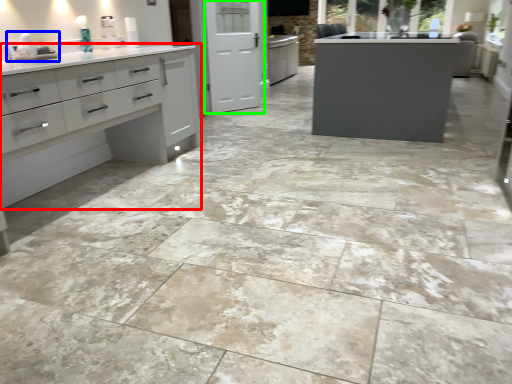
Question: Which object is positioned closest to cupboard (highlighted by a red box)? Select from sink (highlighted by a blue box) and screen door (highlighted by a green box).

Choices:
 (A) sink
 (B) screen door

Answer: (A)